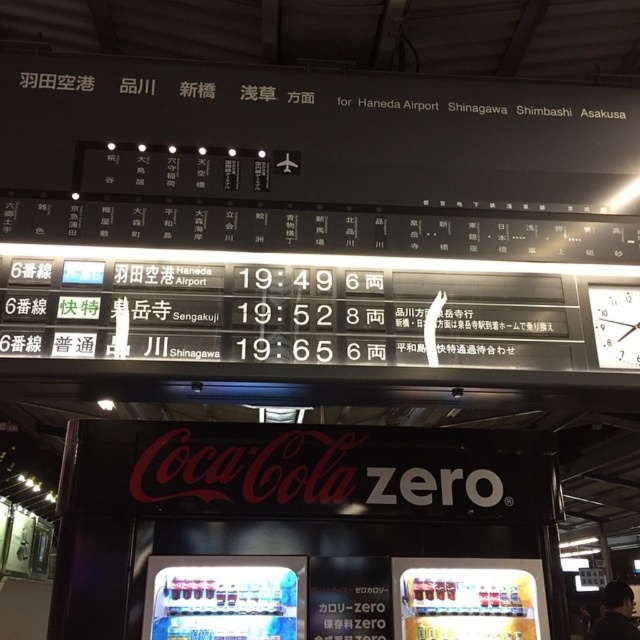
You are at the train station and need to check the train schedule. You see the white plastic scoreboard at upper center and the metallic silver vending machine at lower right. Which object is larger?

The white plastic scoreboard at upper center is bigger than the metallic silver vending machine at lower right.

You are standing in the train station and need to check the train schedule. You see the white plastic scoreboard at upper center and the metallic silver vending machine at lower right. Which object is wider?

The white plastic scoreboard at upper center might be wider than metallic silver vending machine at lower right according to the description.